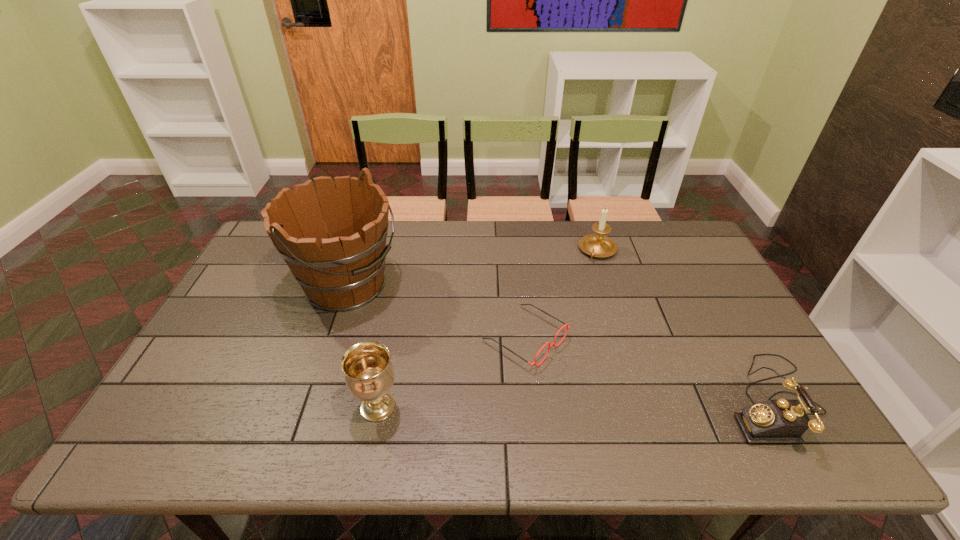
Locate an element on the screen. This screenshot has height=540, width=960. chalice is located at coordinates (369, 375).

I want to click on telephone, so click(x=773, y=421).

Locate an element on the screen. The height and width of the screenshot is (540, 960). the second shortest object is located at coordinates (773, 421).

Find the location of a particular element. wine bucket is located at coordinates (340, 269).

Identify the location of the third object from left to right. The width and height of the screenshot is (960, 540). (568, 326).

This screenshot has height=540, width=960. In order to click on spectacles in this screenshot , I will do `click(568, 326)`.

Find the location of a particular element. the fourth object from left to right is located at coordinates coord(597,245).

This screenshot has height=540, width=960. Find the location of `vacant space located 0.180m on the left of the chalice`. vacant space located 0.180m on the left of the chalice is located at coordinates (280, 407).

At what (x,y) coordinates should I click in order to perform the action: click on free region located 0.080m on the dial of the telephone. Please return your answer as a coordinate pair (x, y). The width and height of the screenshot is (960, 540). Looking at the image, I should click on (692, 401).

At what (x,y) coordinates should I click in order to perform the action: click on vacant space located on the dial of the telephone. Please return your answer as a coordinate pair (x, y). Looking at the image, I should click on [x=630, y=401].